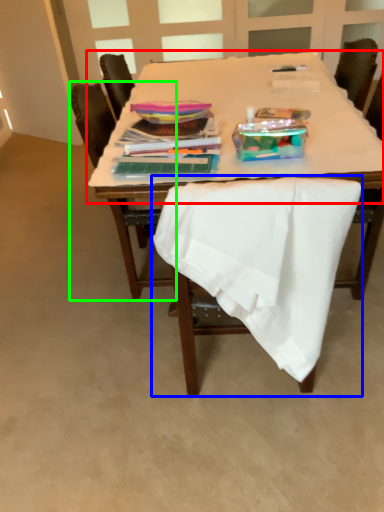
Question: Which object is the farthest from round table (highlighted by a red box)? Choose among these: chair (highlighted by a blue box) or chair (highlighted by a green box).

Choices:
 (A) chair
 (B) chair

Answer: (A)